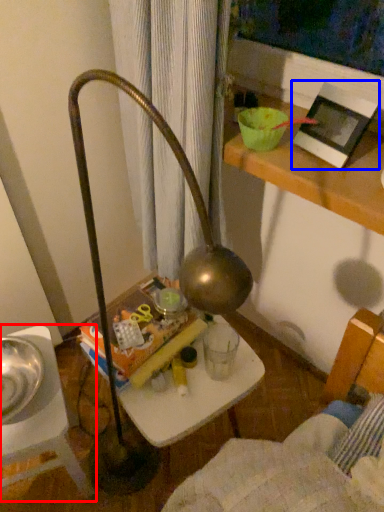
Question: Which object is further to the camera taking this photo, furniture (highlighted by a red box) or picture frame (highlighted by a blue box)?

Choices:
 (A) furniture
 (B) picture frame

Answer: (A)